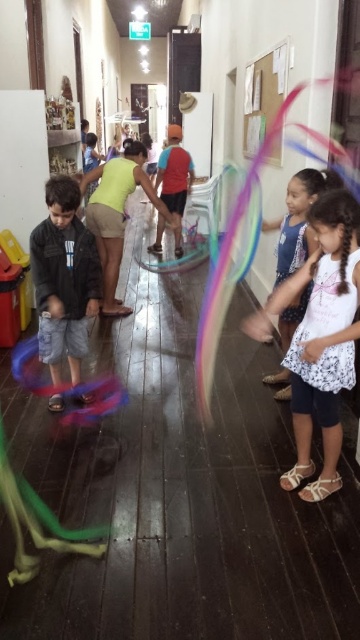
Question: Among these objects, which one is farthest from the camera?

Choices:
 (A) matte red shirt at center
 (B) matte black jacket at left
 (C) light green fabric shirt at center
 (D) white floral dress at right

Answer: (A)

Question: Which of the following is the farthest from the observer?

Choices:
 (A) light green fabric shirt at center
 (B) white printed dress at center
 (C) matte red shirt at center

Answer: (C)

Question: Based on their relative distances, which object is nearer to the white floral dress at right?

Choices:
 (A) light green fabric shirt at center
 (B) matte red shirt at center
 (C) white printed dress at center
 (D) matte black jacket at left

Answer: (C)

Question: Does white printed dress at center appear under matte red shirt at center?

Choices:
 (A) yes
 (B) no

Answer: (A)

Question: Is white floral dress at right closer to the viewer compared to matte black jacket at left?

Choices:
 (A) no
 (B) yes

Answer: (B)

Question: Observing the image, what is the correct spatial positioning of white floral dress at right in reference to matte black jacket at left?

Choices:
 (A) right
 (B) left

Answer: (A)